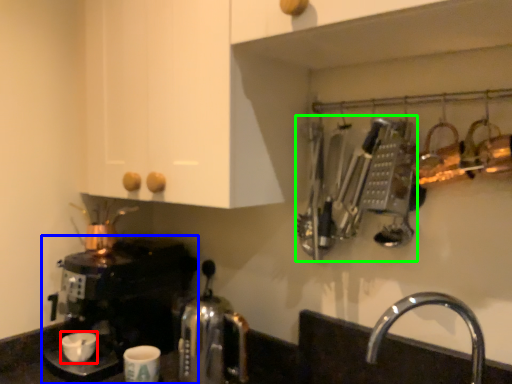
Question: Based on their relative distances, which object is nearer to coffee cup (highlighted by a red box)? Choose from coffee maker (highlighted by a blue box) and cutlery (highlighted by a green box).

Choices:
 (A) coffee maker
 (B) cutlery

Answer: (A)